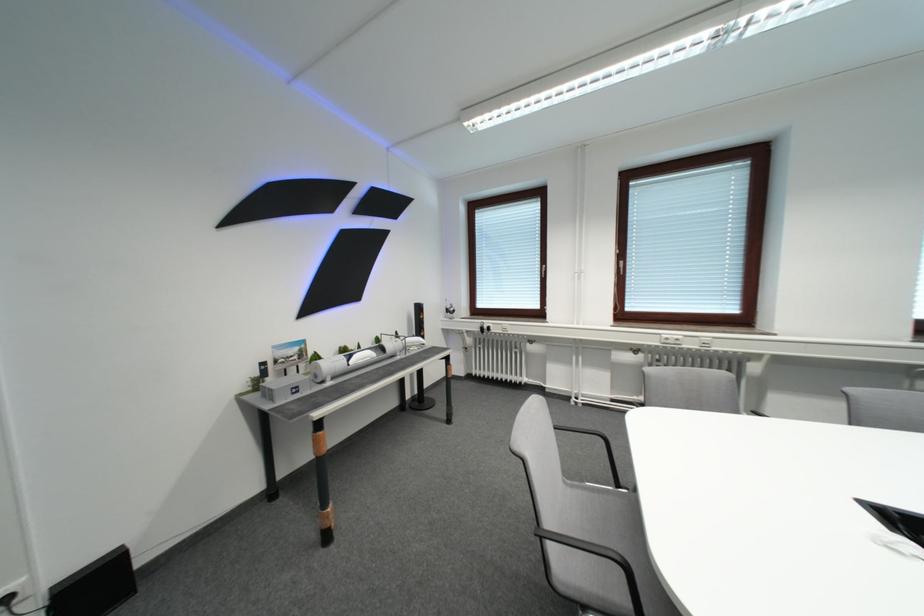
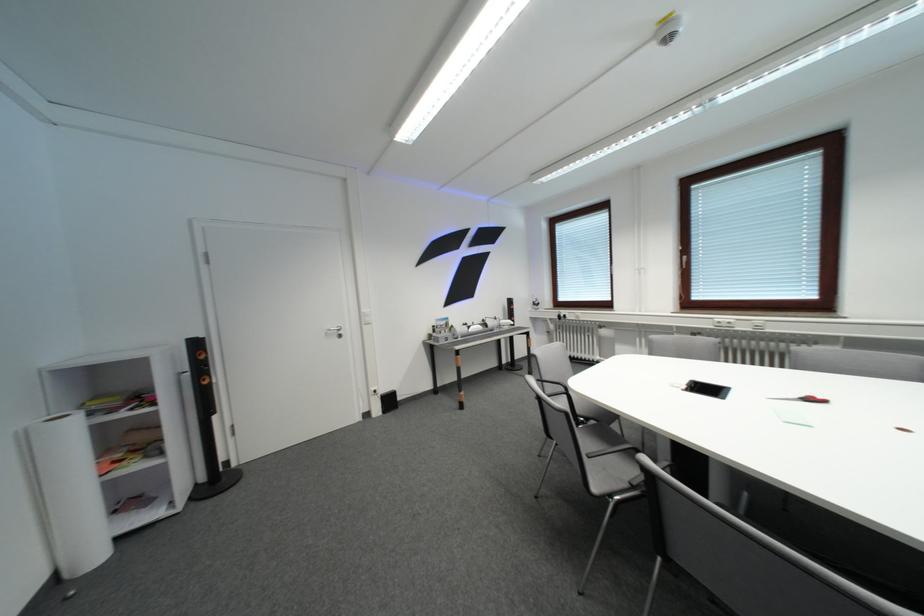
Locate, in the second image, the point that corresponds to point 359,360 in the first image.

(479, 330)